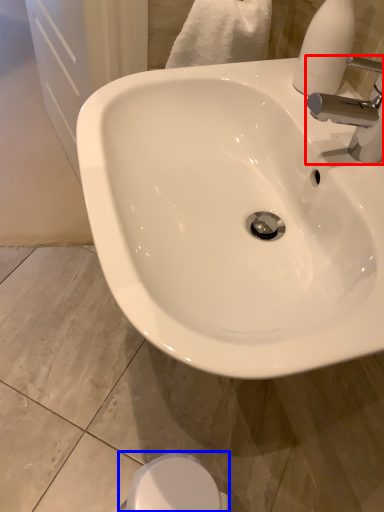
Question: Which point is further to the camera, tap (highlighted by a red box) or bidet (highlighted by a blue box)?

Choices:
 (A) tap
 (B) bidet

Answer: (B)